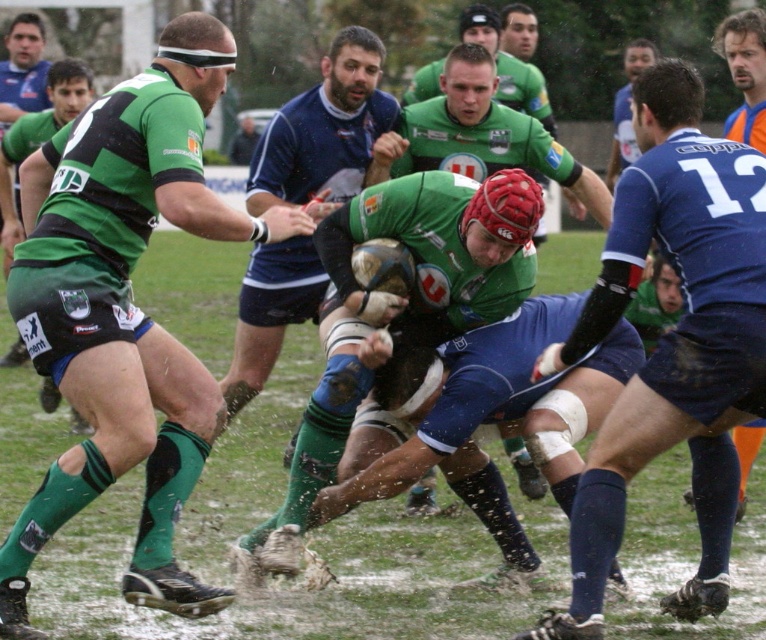
Consider the image. Does green jersey at center appear under blue matte jersey at center?

No.

Is green jersey at center further to camera compared to blue matte jersey at center?

Yes.

The height and width of the screenshot is (640, 766). What are the coordinates of `green jersey at center` in the screenshot? It's located at (x=123, y=310).

The height and width of the screenshot is (640, 766). What are the coordinates of `green jersey at center` in the screenshot? It's located at (123, 310).